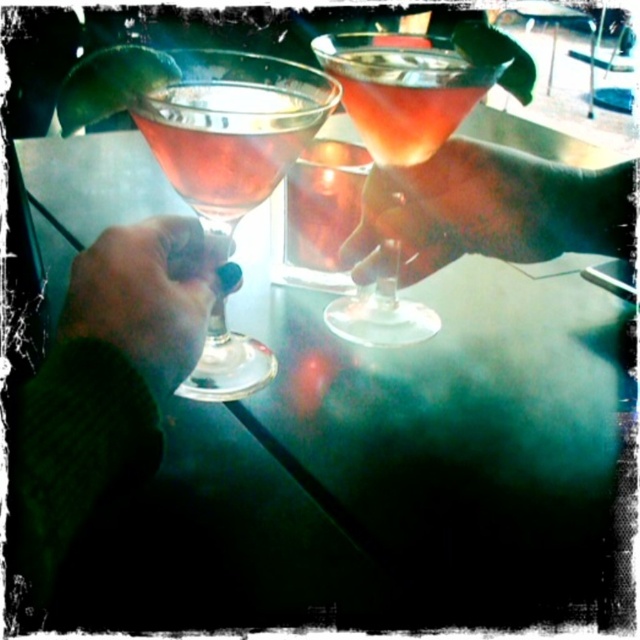
Question: Which object appears farthest from the camera in this image?

Choices:
 (A) matte glass at center
 (B) green knitted sweater at left
 (C) translucent glass martini at center

Answer: (A)

Question: Can you confirm if green knitted sweater at left is positioned above matte glass at center?

Choices:
 (A) yes
 (B) no

Answer: (B)

Question: Can you confirm if transparent glass martini at left is wider than matte glass at left?

Choices:
 (A) yes
 (B) no

Answer: (B)

Question: Is green knitted sweater at left wider than translucent glass drink at center?

Choices:
 (A) no
 (B) yes

Answer: (A)

Question: Among these objects, which one is farthest from the camera?

Choices:
 (A) matte black hand at lower left
 (B) green knitted sweater at left
 (C) matte glass at center
 (D) translucent glass drink at center

Answer: (C)

Question: Which of the following is the farthest from the observer?

Choices:
 (A) (278, 140)
 (B) (196, 381)

Answer: (B)